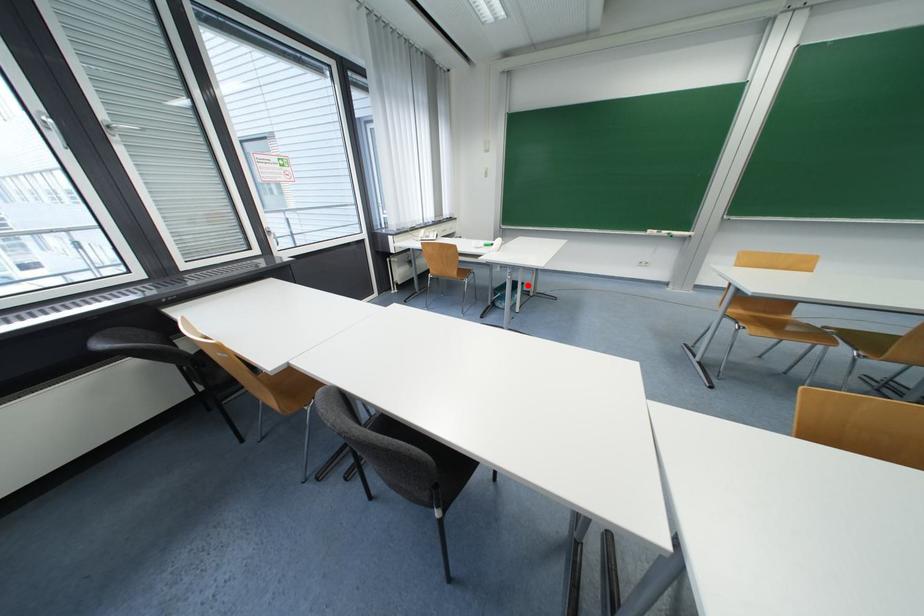
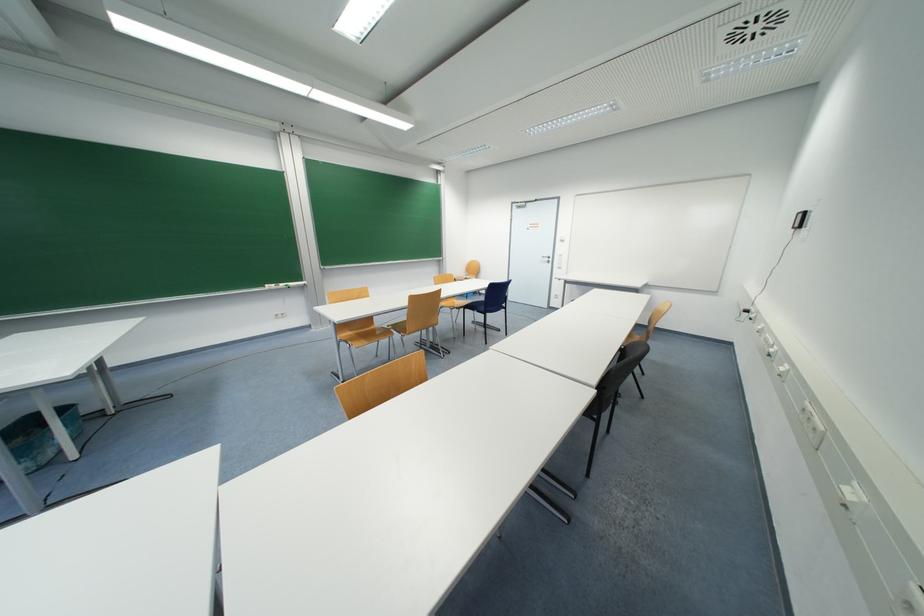
Find the pixel in the second image that matches the highlighted location in the first image.

(69, 410)